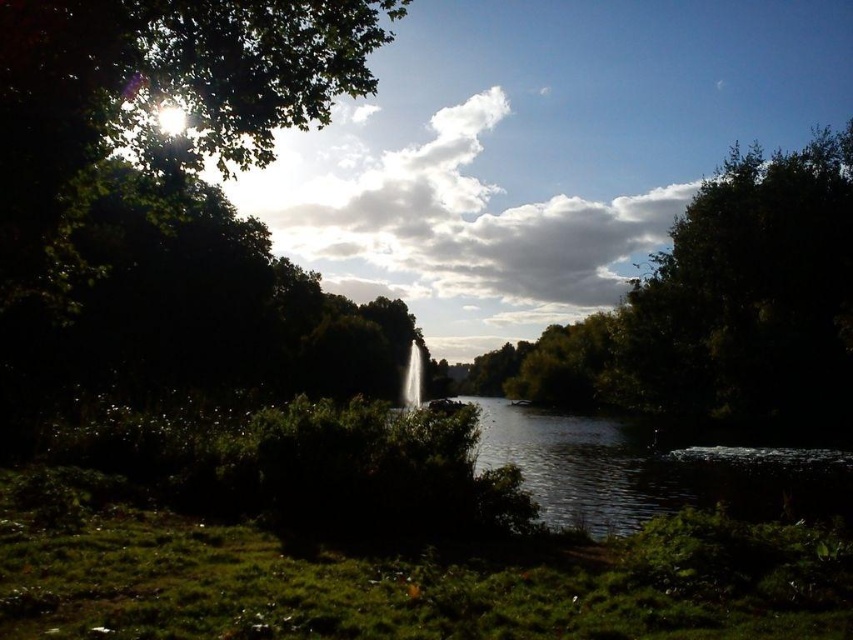
Looking at this image, you are standing in the outdoor scene and want to take a photo of both the green leafy tree at upper right and the white fluffy cloud at upper center. Which object should you focus on first to ensure both are in sharp focus?

You should focus on the green leafy tree at upper right first because it is closer to the viewer than the white fluffy cloud at upper center. By focusing on the closer object, the cloud in the background will also be in focus due to the depth of field.

You are an artist sketching this scene and want to ensure proportions are accurate. Which object has a smaller width between the green leafy tree at upper right and the white fluffy cloud at upper center?

The green leafy tree at upper right has a smaller width compared to the white fluffy cloud at upper center.